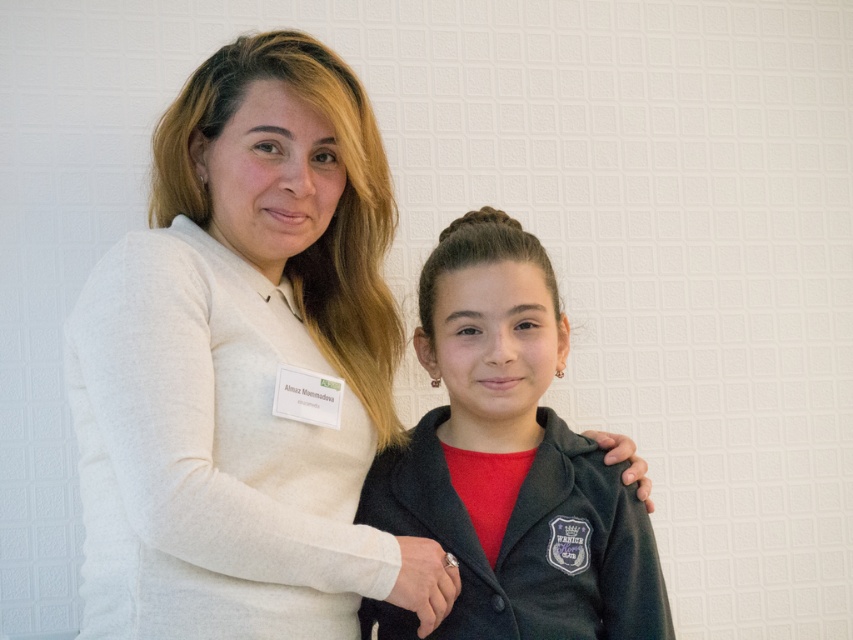
Does white soft sweater at upper left have a larger size compared to matte black jacket at center?

Correct, white soft sweater at upper left is larger in size than matte black jacket at center.

Locate an element on the screen. The width and height of the screenshot is (853, 640). white soft sweater at upper left is located at coordinates (244, 365).

I want to click on white soft sweater at upper left, so click(x=244, y=365).